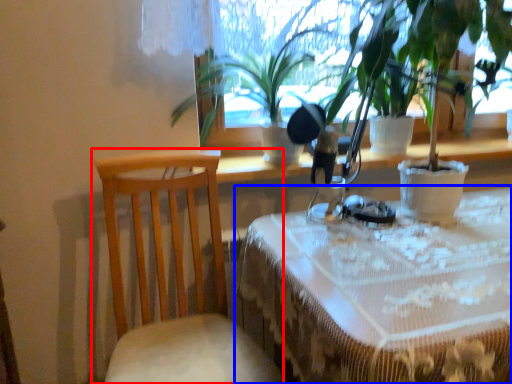
Question: Which object is closer to the camera taking this photo, chair (highlighted by a red box) or table (highlighted by a blue box)?

Choices:
 (A) chair
 (B) table

Answer: (B)